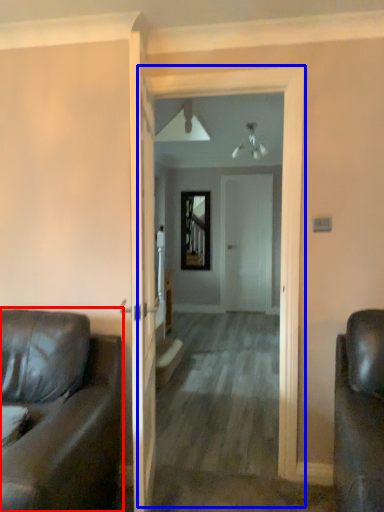
Question: Which object is further to the camera taking this photo, studio couch (highlighted by a red box) or corridor (highlighted by a blue box)?

Choices:
 (A) studio couch
 (B) corridor

Answer: (B)